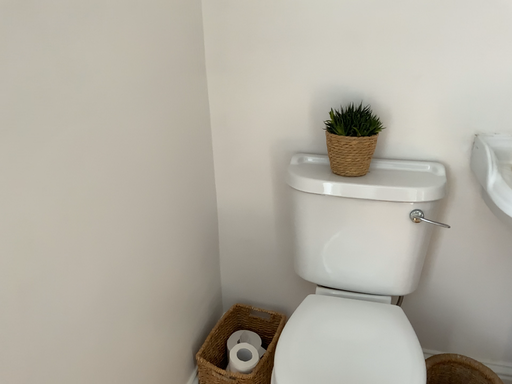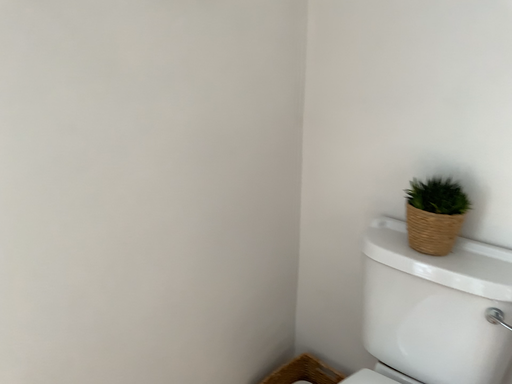
Question: How did the camera likely rotate when shooting the video?

Choices:
 (A) rotated left
 (B) rotated right

Answer: (A)